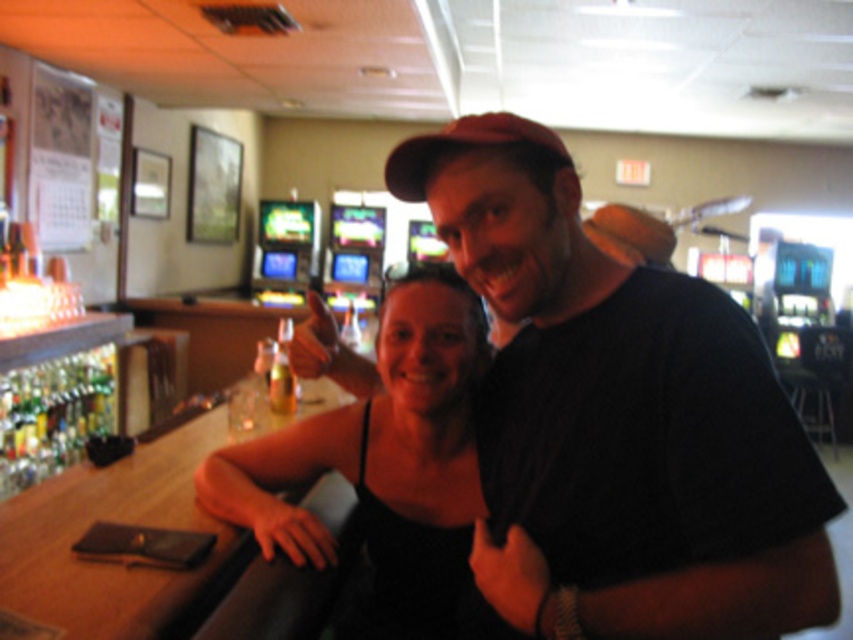
Between black fabric dress at center and green glass bottle at bar, which one appears on the right side from the viewer's perspective?

Positioned to the right is black fabric dress at center.

The image size is (853, 640). Describe the element at coordinates (383, 460) in the screenshot. I see `black fabric dress at center` at that location.

Who is more forward, (460, 422) or (53, 440)?

Point (460, 422) is more forward.

Locate an element on the screen. This screenshot has width=853, height=640. black fabric dress at center is located at coordinates (383, 460).

Is green glass bottle at bar to the left of translucent glass bottle at bar from the viewer's perspective?

Yes, green glass bottle at bar is to the left of translucent glass bottle at bar.

Where is `green glass bottle at bar`? This screenshot has width=853, height=640. green glass bottle at bar is located at coordinates (53, 413).

Where is `green glass bottle at bar`? The width and height of the screenshot is (853, 640). green glass bottle at bar is located at coordinates (53, 413).

Identify the location of green glass bottle at bar. (53, 413).

Does black matte t-shirt at center appear on the right side of black fabric dress at center?

Correct, you'll find black matte t-shirt at center to the right of black fabric dress at center.

Who is more forward, (792, 528) or (410, 522)?

Point (792, 528) is in front.

Is point (544, 280) in front of point (360, 452)?

Yes, it is in front of point (360, 452).

This screenshot has width=853, height=640. Identify the location of black matte t-shirt at center. (618, 419).